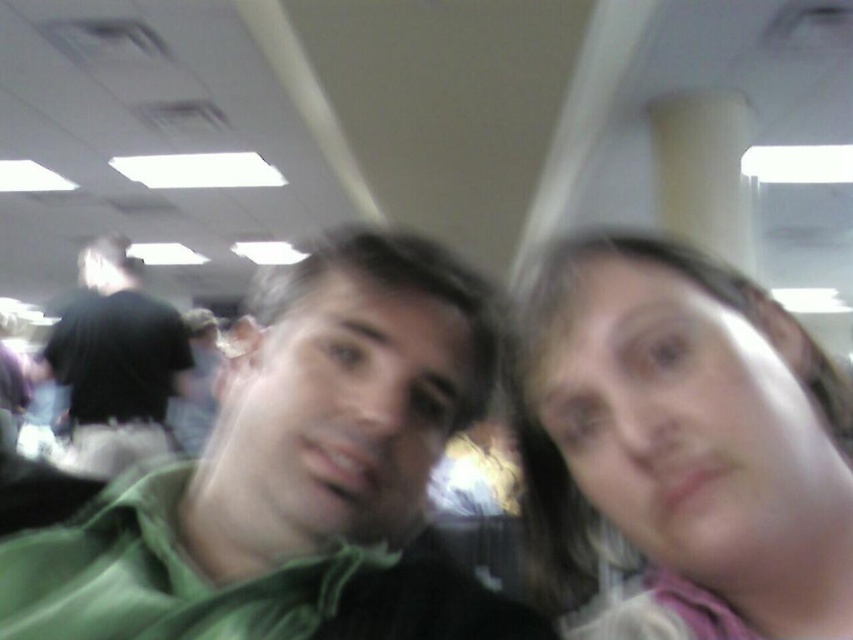
Between point (836, 435) and point (48, 371), which one is positioned in front?

Point (836, 435) is more forward.

Does point (659, 280) lie behind point (71, 445)?

No, it is not.

The width and height of the screenshot is (853, 640). Describe the element at coordinates (677, 449) in the screenshot. I see `blonde hair at upper right` at that location.

This screenshot has height=640, width=853. Identify the location of blonde hair at upper right. (677, 449).

Does green matte shirt at center have a smaller size compared to black matte shirt at left?

Yes.

Is green matte shirt at center taller than black matte shirt at left?

No.

Measure the distance between green matte shirt at center and camera.

A distance of 43.12 centimeters exists between green matte shirt at center and camera.

Where is `green matte shirt at center`? The image size is (853, 640). green matte shirt at center is located at coordinates (296, 476).

Does green matte shirt at center appear under blonde hair at upper right?

Incorrect, green matte shirt at center is not positioned below blonde hair at upper right.

The image size is (853, 640). I want to click on green matte shirt at center, so click(x=296, y=476).

Where is `green matte shirt at center`? green matte shirt at center is located at coordinates (296, 476).